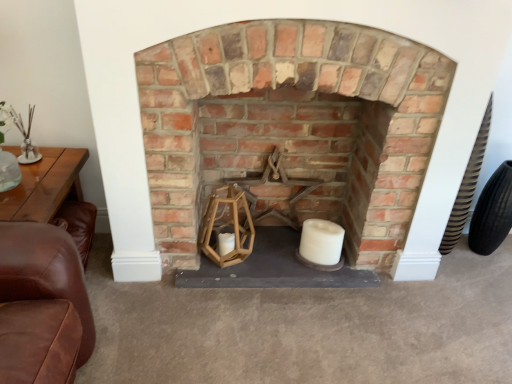
Where is `black rubber tire at right`? This screenshot has width=512, height=384. black rubber tire at right is located at coordinates (492, 212).

You are a GUI agent. You are given a task and a screenshot of the screen. Output one action in this format:
    pyautogui.click(x=<x>, y=<y>)
    Task: Click on the rustic brick fireplace at center
    The height and width of the screenshot is (384, 512).
    Given the screenshot: What is the action you would take?
    pyautogui.click(x=292, y=124)

In the image, there is a rustic brick fireplace at center. Where is `tire below it (from the image's perspective)`? Image resolution: width=512 pixels, height=384 pixels. tire below it (from the image's perspective) is located at coordinates (492, 212).

Which is in front, point (500, 208) or point (168, 95)?

The point (168, 95) is in front.

Is black rubber tire at right located outside rustic brick fireplace at center?

That's correct, black rubber tire at right is outside of rustic brick fireplace at center.

Is black rubber tire at right wider or thinner than rustic brick fireplace at center?

black rubber tire at right is thinner than rustic brick fireplace at center.

Considering the sizes of objects rustic brick fireplace at center and black rubber tire at right in the image provided, who is wider, rustic brick fireplace at center or black rubber tire at right?

rustic brick fireplace at center is wider.

Measure the distance from rustic brick fireplace at center to black rubber tire at right.

rustic brick fireplace at center and black rubber tire at right are 37.17 inches apart.

Could you tell me if rustic brick fireplace at center is facing black rubber tire at right?

No, rustic brick fireplace at center is not facing towards black rubber tire at right.

Considering the relative sizes of rustic brick fireplace at center and black rubber tire at right in the image provided, is rustic brick fireplace at center shorter than black rubber tire at right?

Incorrect, the height of rustic brick fireplace at center does not fall short of that of black rubber tire at right.

Find the location of a particular element. The image size is (512, 384). tire above the white matte candle at center (from a real-world perspective) is located at coordinates (492, 212).

From a real-world perspective, is black rubber tire at right physically below white matte candle at center?

No, from a real-world perspective, black rubber tire at right is not beneath white matte candle at center.

How different are the orientations of black rubber tire at right and white matte candle at center in degrees?

There is a 3.1-degree angle between the facing directions of black rubber tire at right and white matte candle at center.

Considering the sizes of objects black rubber tire at right and white matte candle at center in the image provided, who is thinner, black rubber tire at right or white matte candle at center?

black rubber tire at right is thinner.

Can you confirm if rustic brick fireplace at center is smaller than white matte candle at center?

No, rustic brick fireplace at center is not smaller than white matte candle at center.

What's the angular difference between rustic brick fireplace at center and white matte candle at center's facing directions?

There is a 0.405-degree angle between the facing directions of rustic brick fireplace at center and white matte candle at center.

Considering their positions, is rustic brick fireplace at center located in front of or behind white matte candle at center?

Visually, rustic brick fireplace at center is located in front of white matte candle at center.

Considering the relative sizes of rustic brick fireplace at center and white matte candle at center in the image provided, is rustic brick fireplace at center thinner than white matte candle at center?

Incorrect, the width of rustic brick fireplace at center is not less than that of white matte candle at center.

Which object is closer to the camera taking this photo, white matte candle at center or black rubber tire at right?

white matte candle at center is in front.

In the scene shown: Is there a large distance between white matte candle at center and black rubber tire at right?

That's not correct — white matte candle at center is a little close to black rubber tire at right.

What's the angular difference between white matte candle at center and black rubber tire at right's facing directions?

3.1 degrees.

In the scene shown: Based on their positions, is white matte candle at center located to the left or right of black rubber tire at right?

white matte candle at center is positioned on black rubber tire at right's left side.

What's the angular difference between white matte candle at center and rustic brick fireplace at center's facing directions?

The angle between the facing direction of white matte candle at center and the facing direction of rustic brick fireplace at center is 0.405 degrees.

Does white matte candle at center turn towards rustic brick fireplace at center?

Yes, white matte candle at center faces towards rustic brick fireplace at center.

Is white matte candle at center to the left or to the right of rustic brick fireplace at center in the image?

In the image, white matte candle at center appears on the right side of rustic brick fireplace at center.

Is white matte candle at center next to rustic brick fireplace at center and touching it?

white matte candle at center and rustic brick fireplace at center are clearly separated.

In order to click on fireplace on the left of the black rubber tire at right in this screenshot , I will do `click(292, 124)`.

Identify the location of fireplace that is above the black rubber tire at right (from a real-world perspective). The image size is (512, 384). (292, 124).

Estimate the real-world distances between objects in this image. Which object is further from rustic brick fireplace at center, black rubber tire at right or white matte candle at center?

The object further to rustic brick fireplace at center is black rubber tire at right.

Looking at the image, which one is located closer to rustic brick fireplace at center, white matte candle at center or black rubber tire at right?

Among the two, white matte candle at center is located nearer to rustic brick fireplace at center.

Looking at the image, which one is located closer to black rubber tire at right, rustic brick fireplace at center or white matte candle at center?

The object closer to black rubber tire at right is white matte candle at center.

Based on their spatial positions, is white matte candle at center or rustic brick fireplace at center further from black rubber tire at right?

rustic brick fireplace at center is positioned further to the anchor black rubber tire at right.

Which object lies further to the anchor point white matte candle at center, rustic brick fireplace at center or black rubber tire at right?

black rubber tire at right is positioned further to the anchor white matte candle at center.

From the image, which object appears to be farther from white matte candle at center, black rubber tire at right or rustic brick fireplace at center?

Among the two, black rubber tire at right is located further to white matte candle at center.

Find the location of `candle situated between rustic brick fireplace at center and black rubber tire at right from left to right`. candle situated between rustic brick fireplace at center and black rubber tire at right from left to right is located at coordinates (321, 241).